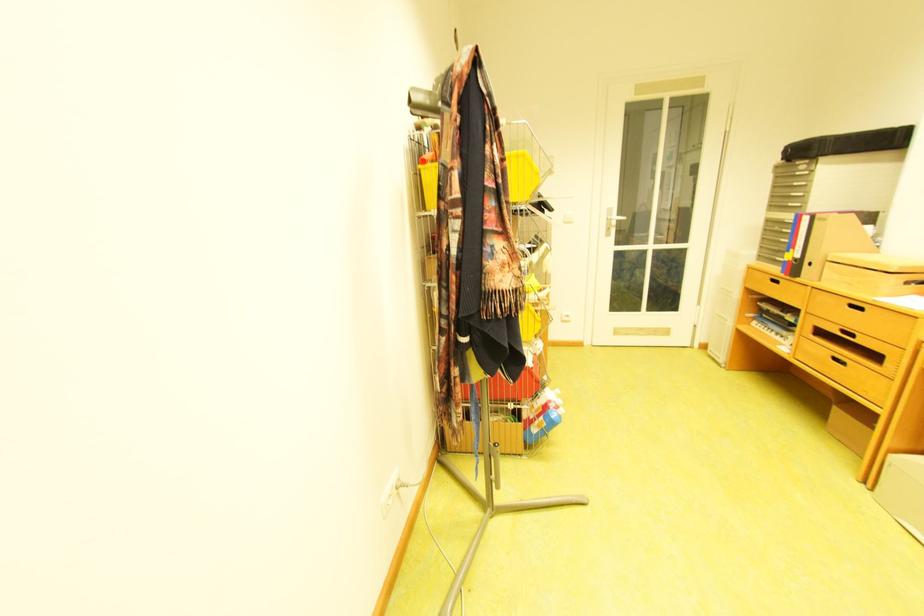
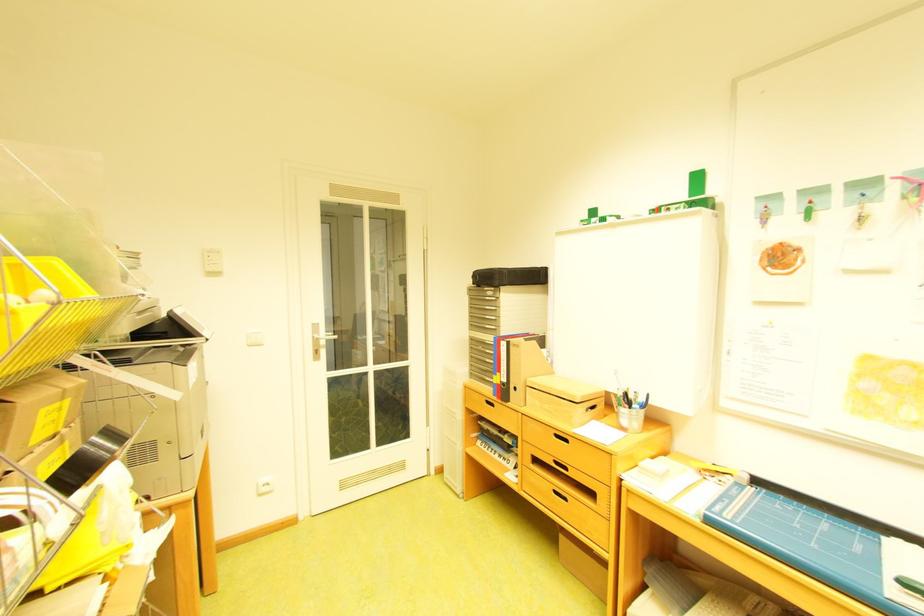
Find the pixel in the second image that matches pixel 621 217 in the first image.

(327, 337)